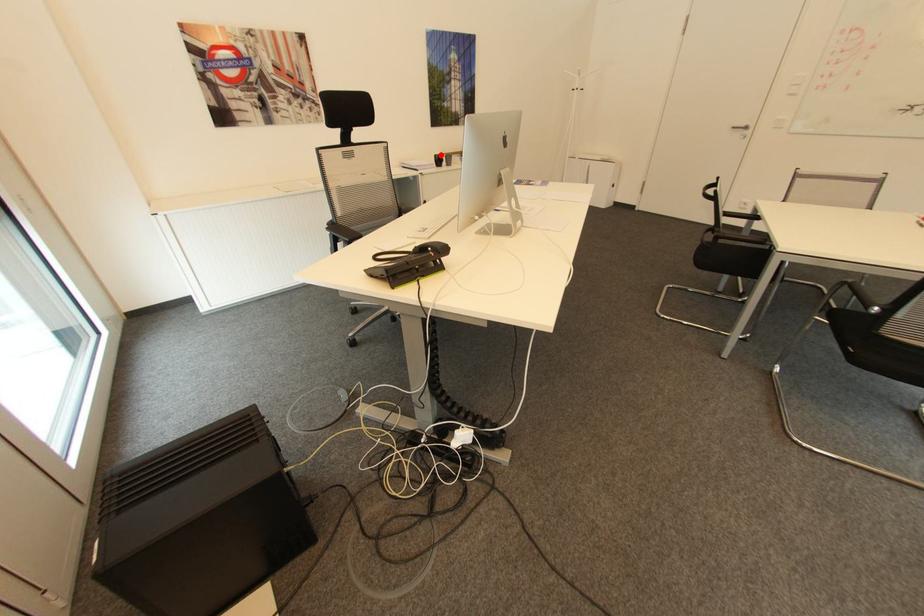
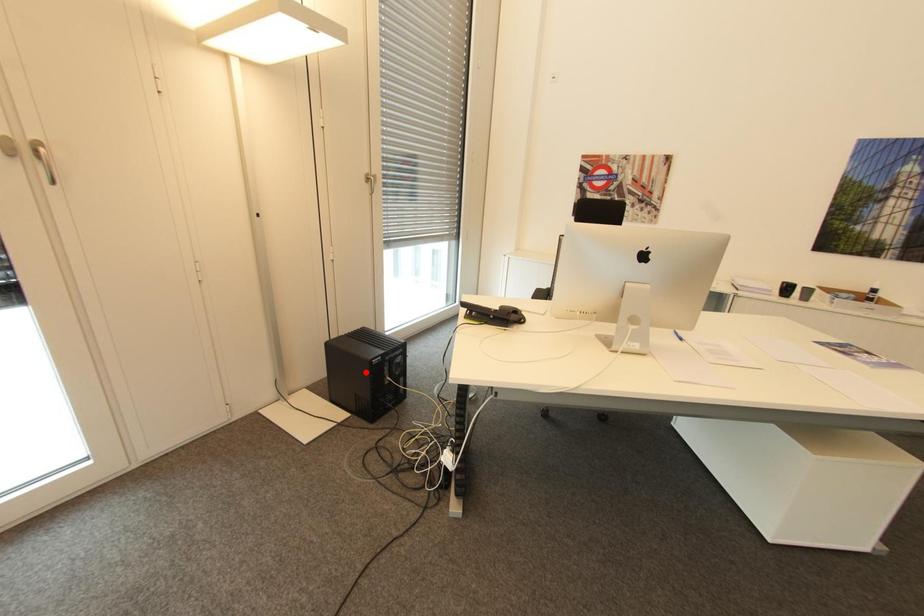
I am providing you with two images of the same scene from different viewpoints. A red point is marked on the first image and another point is marked on the second image. Does the point marked in image1 correspond to the same location as the one in image2?

No